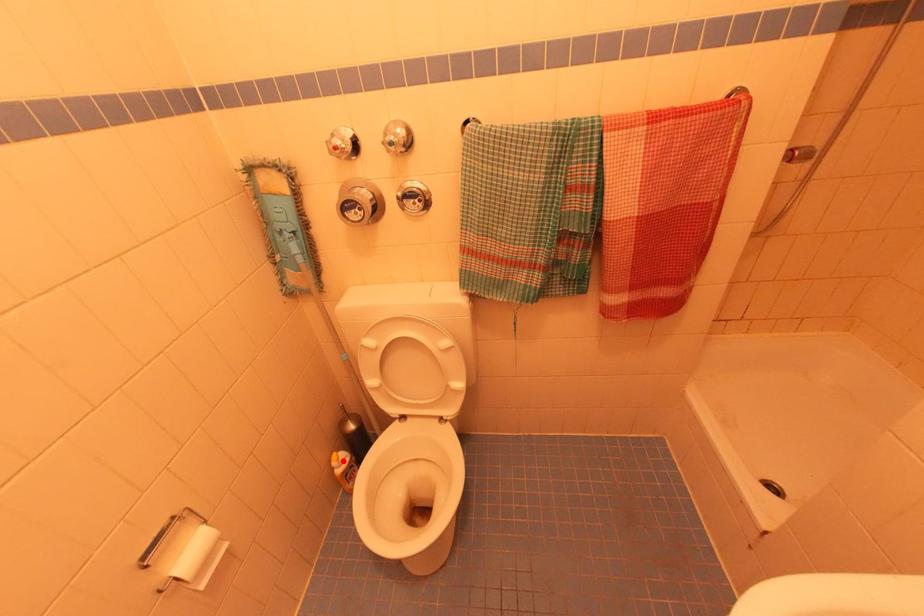
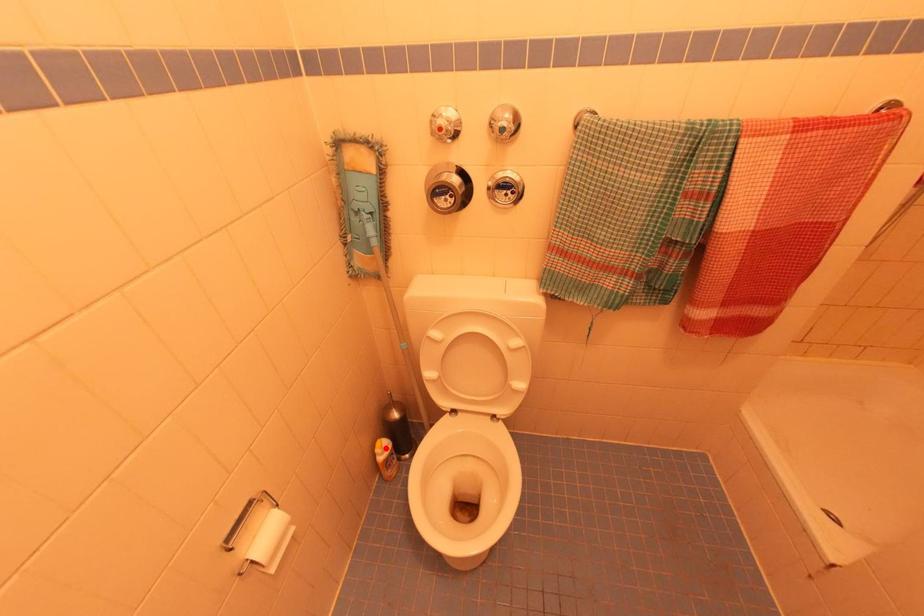
I am providing you with two images of the same scene from different viewpoints. A red point is marked on the first image and another point is marked on the second image. Is the marked point in image1 the same physical position as the marked point in image2?

Yes